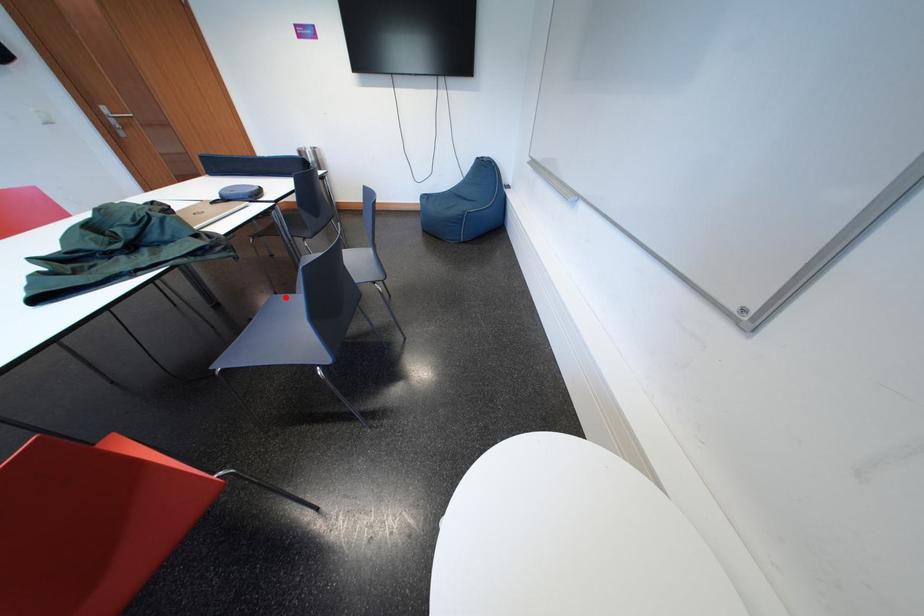
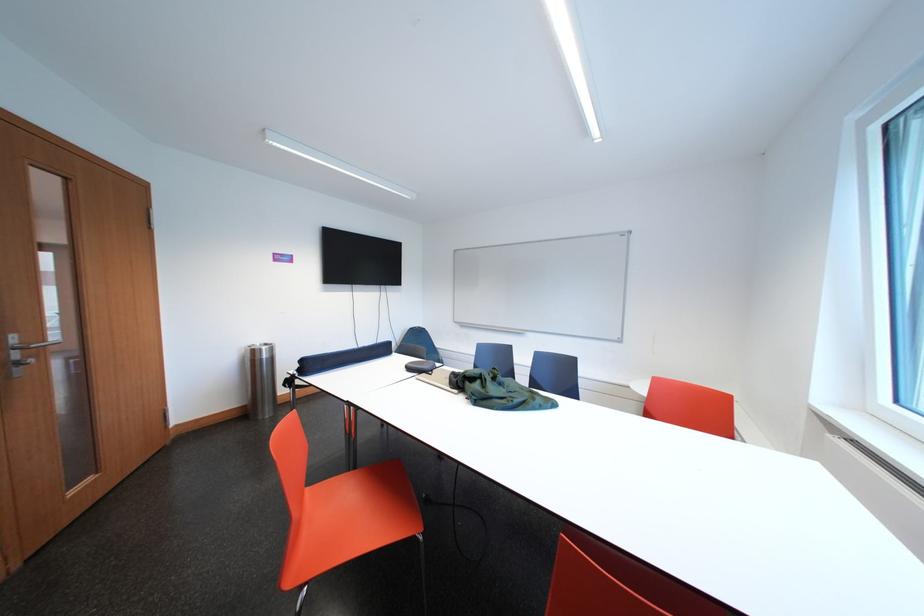
Question: I am providing you with two images of the same scene from different viewpoints. A red point is marked on the first image. Can you still see the location of the red point in image 2?

Choices:
 (A) Yes
 (B) No

Answer: (B)